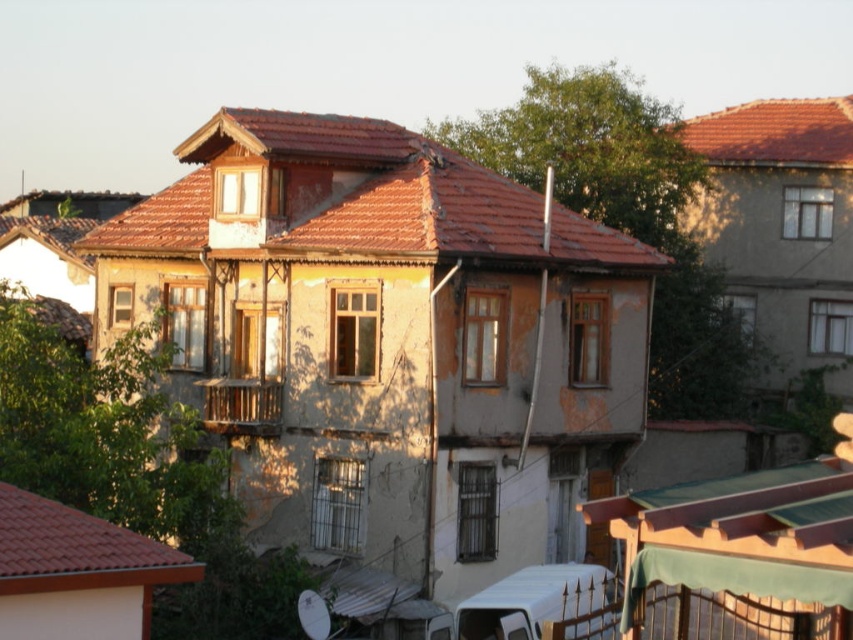
Does brown tile roof at center lie in front of red tile roof at upper right?

Yes, brown tile roof at center is closer to the viewer.

Is point (509, 211) farther from viewer compared to point (735, 108)?

No, it is not.

Locate an element on the screen. The height and width of the screenshot is (640, 853). brown tile roof at center is located at coordinates (357, 189).

Is red tile roof at lower left closer to the viewer compared to red tile roof at upper right?

That is True.

Is point (32, 557) positioned behind point (840, 132)?

No, it is not.

Where is `red tile roof at lower left`? red tile roof at lower left is located at coordinates (77, 548).

Who is higher up, brown tile roof at center or red tile roof at lower left?

Positioned higher is brown tile roof at center.

Who is shorter, brown tile roof at center or red tile roof at lower left?

red tile roof at lower left is shorter.

Is point (314, 124) in front of point (109, 528)?

No, (314, 124) is further to viewer.

The height and width of the screenshot is (640, 853). In order to click on brown tile roof at center in this screenshot , I will do `click(357, 189)`.